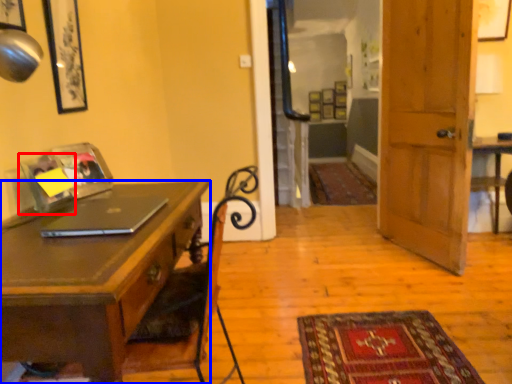
Question: Which of the following is the closest to the observer, picture frame (highlighted by a red box) or desk (highlighted by a blue box)?

Choices:
 (A) picture frame
 (B) desk

Answer: (B)